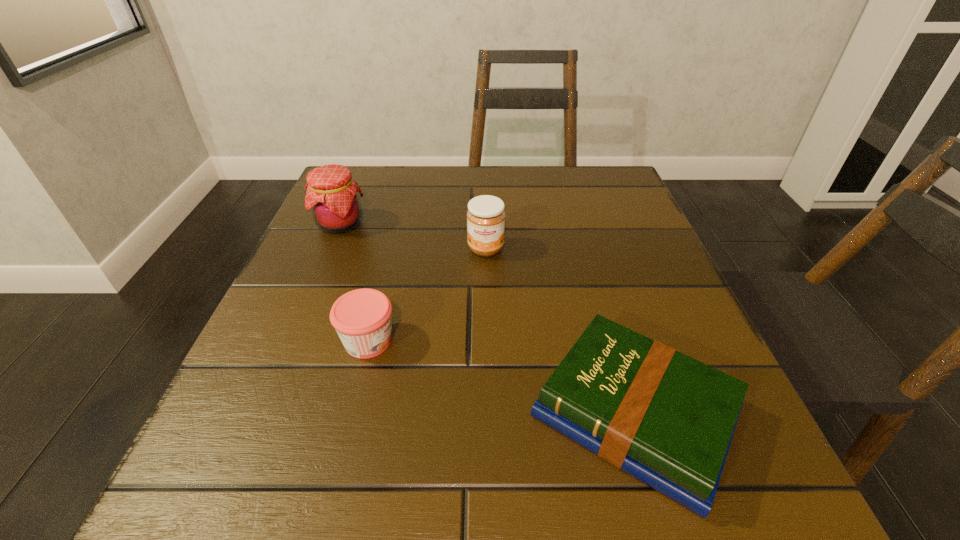
The width and height of the screenshot is (960, 540). Find the location of `vacant space at the near left corner of the desktop`. vacant space at the near left corner of the desktop is located at coordinates (228, 489).

Locate an element on the screen. unoccupied position between the leftmost jam and the second shortest object is located at coordinates (354, 282).

Locate an element on the screen. The width and height of the screenshot is (960, 540). vacant area that lies between the nearest jam and the rightmost jam is located at coordinates (427, 295).

What are the coordinates of `vacant area that lies between the third object from left to right and the rightmost object` in the screenshot? It's located at (560, 331).

You are a GUI agent. You are given a task and a screenshot of the screen. Output one action in this format:
    pyautogui.click(x=<x>, y=<y>)
    Task: Click on the vacant space that is in between the second object from right to left and the rightmost object
    This screenshot has height=540, width=960.
    Given the screenshot: What is the action you would take?
    pyautogui.click(x=560, y=331)

Where is `unoccupied area between the second jam from left to right and the third object from left to right`? This screenshot has width=960, height=540. unoccupied area between the second jam from left to right and the third object from left to right is located at coordinates (427, 295).

Image resolution: width=960 pixels, height=540 pixels. What are the coordinates of `free space between the rightmost object and the third object from right to left` in the screenshot? It's located at (501, 377).

I want to click on vacant area that lies between the nearest jam and the rightmost jam, so click(x=427, y=295).

Find the location of a particular element. free space that is in between the rightmost jam and the second shortest object is located at coordinates (427, 295).

You are a GUI agent. You are given a task and a screenshot of the screen. Output one action in this format:
    pyautogui.click(x=<x>, y=<y>)
    Task: Click on the empty space between the rightmost jam and the leftmost jam
    The height and width of the screenshot is (540, 960).
    Given the screenshot: What is the action you would take?
    pyautogui.click(x=413, y=237)